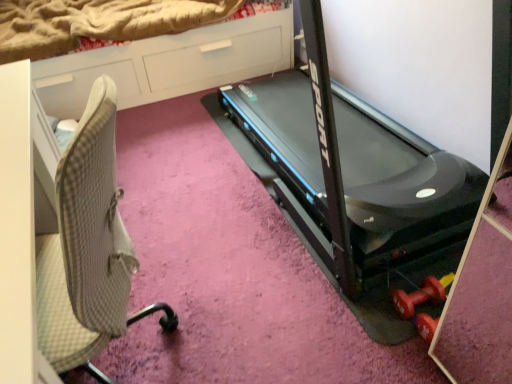
Question: Can you confirm if beige fabric chair at left is positioned to the right of white glossy dresser at upper left?

Choices:
 (A) yes
 (B) no

Answer: (A)

Question: Considering the relative positions of beige fabric chair at left and white glossy dresser at upper left in the image provided, is beige fabric chair at left in front of white glossy dresser at upper left?

Choices:
 (A) yes
 (B) no

Answer: (A)

Question: From the image's perspective, is beige fabric chair at left on white glossy dresser at upper left?

Choices:
 (A) yes
 (B) no

Answer: (B)

Question: Is beige fabric chair at left bigger than white glossy dresser at upper left?

Choices:
 (A) yes
 (B) no

Answer: (B)

Question: Is beige fabric chair at left thinner than white glossy dresser at upper left?

Choices:
 (A) yes
 (B) no

Answer: (A)

Question: Is beige fabric chair at left far from white glossy dresser at upper left?

Choices:
 (A) no
 (B) yes

Answer: (B)

Question: Is black plastic treadmill at center next to beige fabric chair at left and touching it?

Choices:
 (A) no
 (B) yes

Answer: (A)

Question: From the image's perspective, is black plastic treadmill at center below beige fabric chair at left?

Choices:
 (A) no
 (B) yes

Answer: (A)

Question: Can you confirm if black plastic treadmill at center is smaller than beige fabric chair at left?

Choices:
 (A) yes
 (B) no

Answer: (B)

Question: Is black plastic treadmill at center thinner than beige fabric chair at left?

Choices:
 (A) yes
 (B) no

Answer: (B)

Question: Considering the relative sizes of black plastic treadmill at center and beige fabric chair at left in the image provided, is black plastic treadmill at center shorter than beige fabric chair at left?

Choices:
 (A) no
 (B) yes

Answer: (A)

Question: Is black plastic treadmill at center far from beige fabric chair at left?

Choices:
 (A) yes
 (B) no

Answer: (B)

Question: Is beige fabric chair at left aimed at black plastic treadmill at center?

Choices:
 (A) yes
 (B) no

Answer: (B)